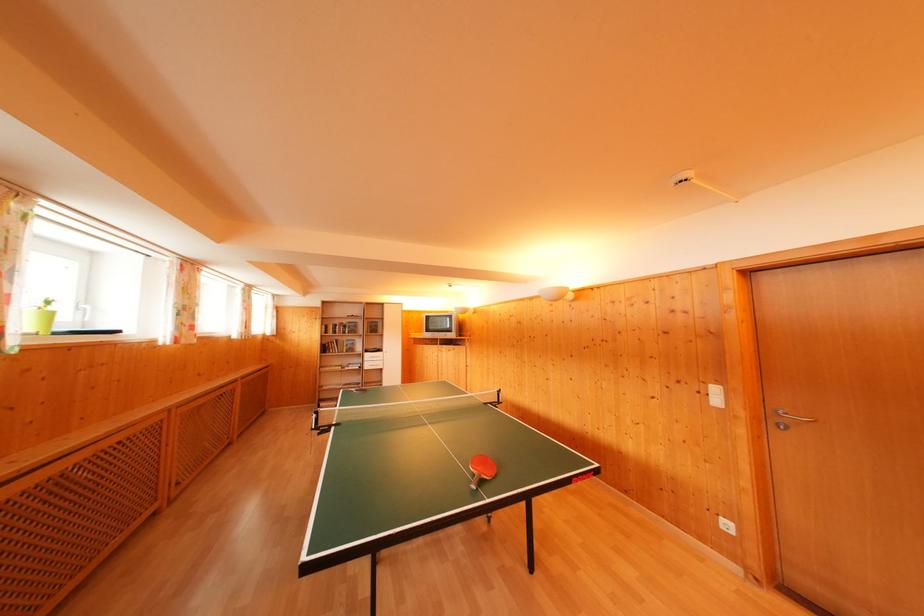
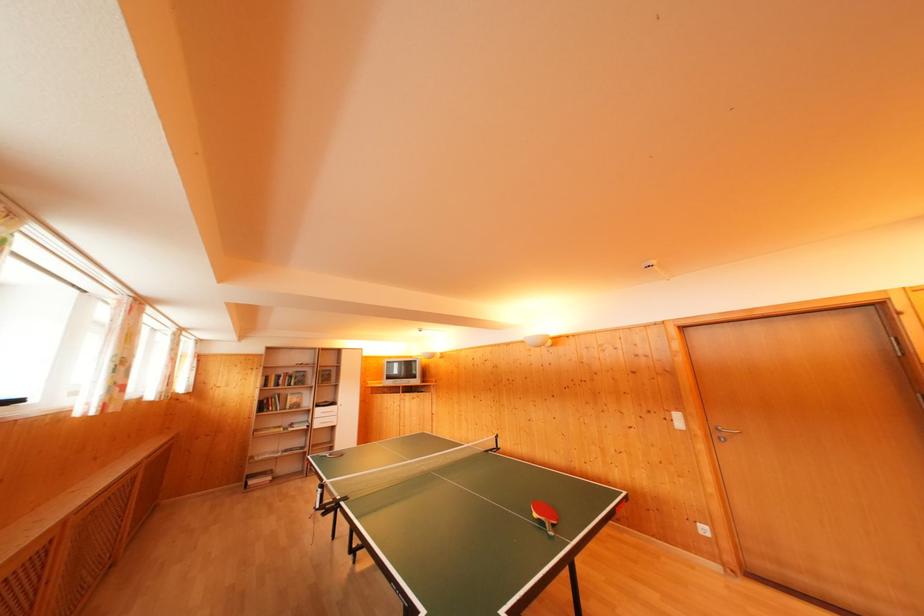
In the second image, find the point that corresponds to (x=342, y=328) in the first image.

(286, 377)